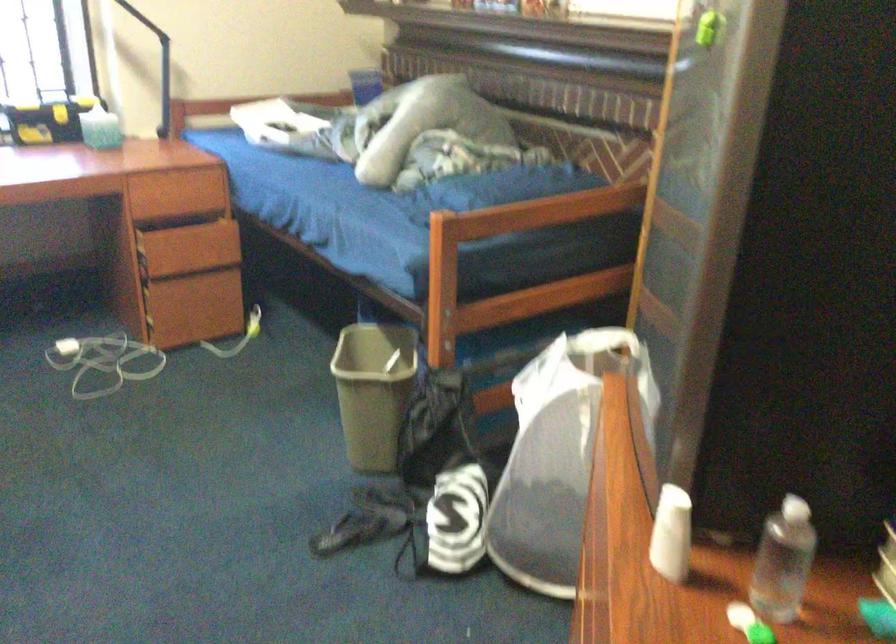
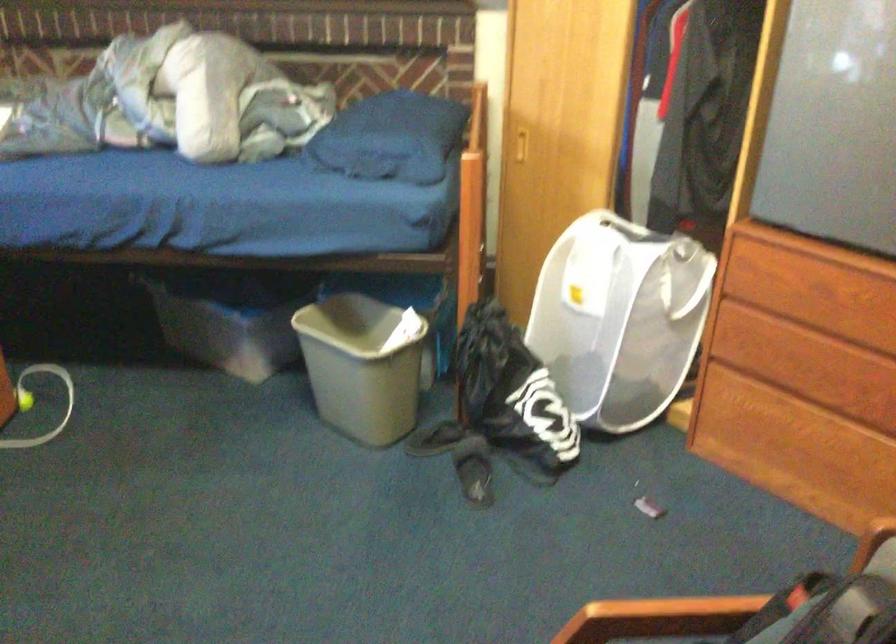
The point at [409,526] is marked in the first image. Where is the corresponding point in the second image?

(474, 469)